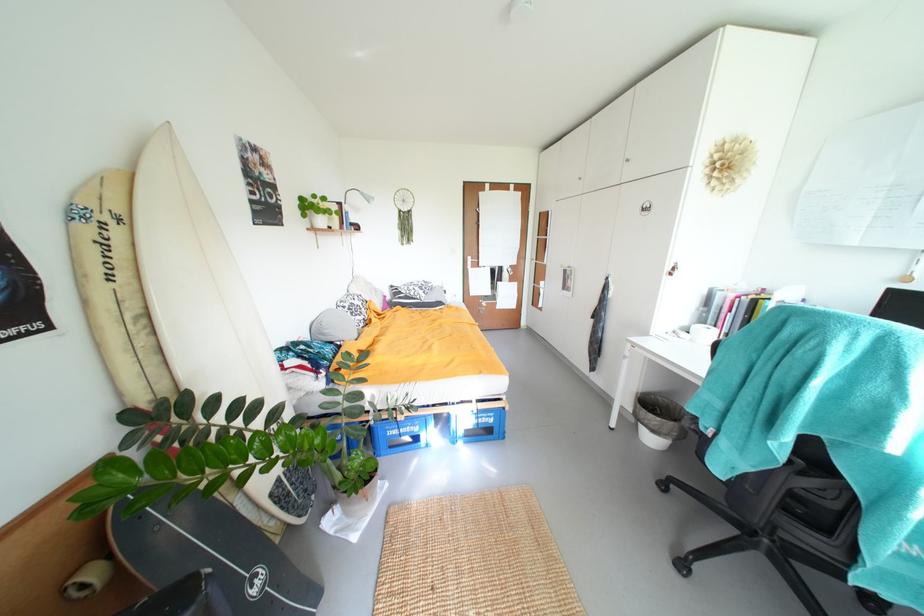
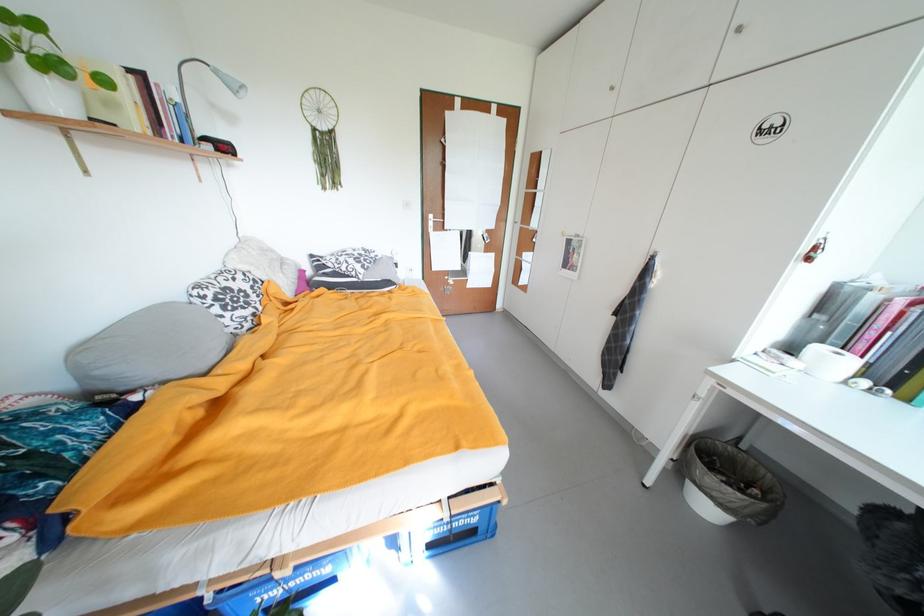
Where in the second image is the point corresponding to point (659, 442) from the first image?

(714, 509)